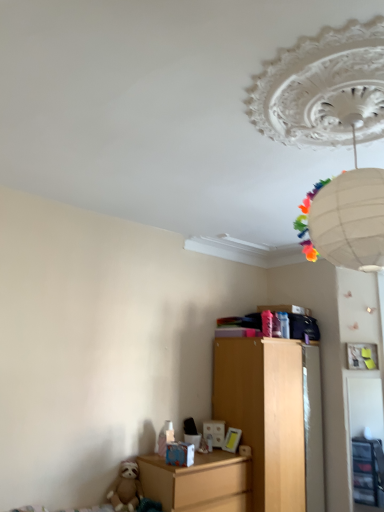
Question: From a real-world perspective, is wooden chest of drawers at center positioned above or below matte wooden nightstand at lower left?

Choices:
 (A) below
 (B) above

Answer: (B)

Question: Considering the relative positions of wooden chest of drawers at center and matte wooden nightstand at lower left in the image provided, is wooden chest of drawers at center to the left or to the right of matte wooden nightstand at lower left?

Choices:
 (A) left
 (B) right

Answer: (B)

Question: Based on their relative distances, which object is nearer to the brown plush sloth at lower left?

Choices:
 (A) wooden chest of drawers at center
 (B) matte wooden nightstand at lower left
 (C) white paper lantern at upper center

Answer: (B)

Question: Which object is positioned closest to the white paper lantern at upper center?

Choices:
 (A) brown plush sloth at lower left
 (B) matte wooden nightstand at lower left
 (C) wooden chest of drawers at center

Answer: (C)